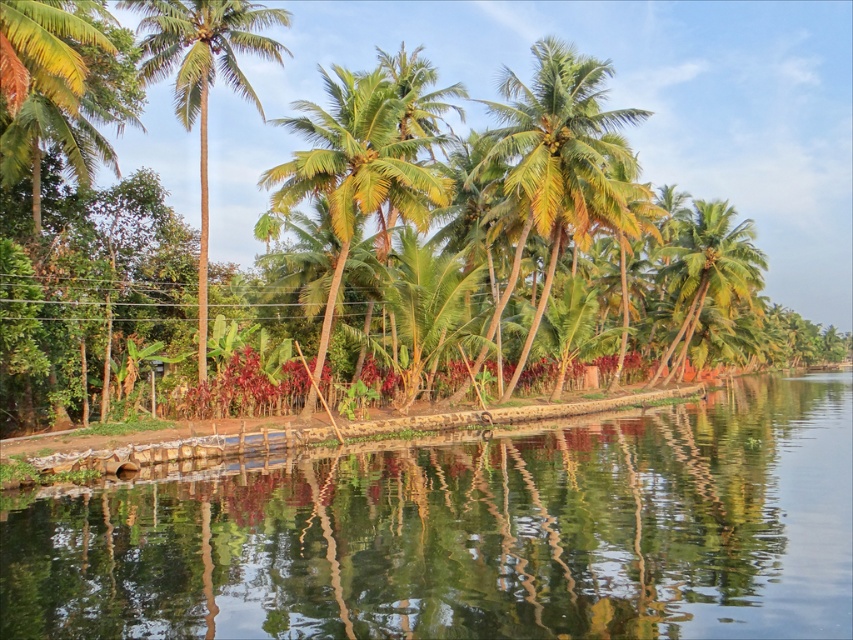
Question: Is green leafy palm trees at center above green leafy palm tree at right?

Choices:
 (A) no
 (B) yes

Answer: (B)

Question: Which point is farther to the camera?

Choices:
 (A) (627, 163)
 (B) (155, 60)

Answer: (A)

Question: Is clear water at center below green leafy palm tree at right?

Choices:
 (A) no
 (B) yes

Answer: (B)

Question: Considering the relative positions of green leafy palm tree at center and green leafy palm tree at right in the image provided, where is green leafy palm tree at center located with respect to green leafy palm tree at right?

Choices:
 (A) above
 (B) below

Answer: (A)

Question: Estimate the real-world distances between objects in this image. Which object is closer to the green leafy palm tree at right?

Choices:
 (A) green leafy palm tree at center
 (B) green leafy palm trees at center
 (C) clear water at center

Answer: (B)

Question: Which point is closer to the camera?

Choices:
 (A) (480, 618)
 (B) (517, 122)
 (C) (686, 346)
 (D) (236, 65)

Answer: (A)